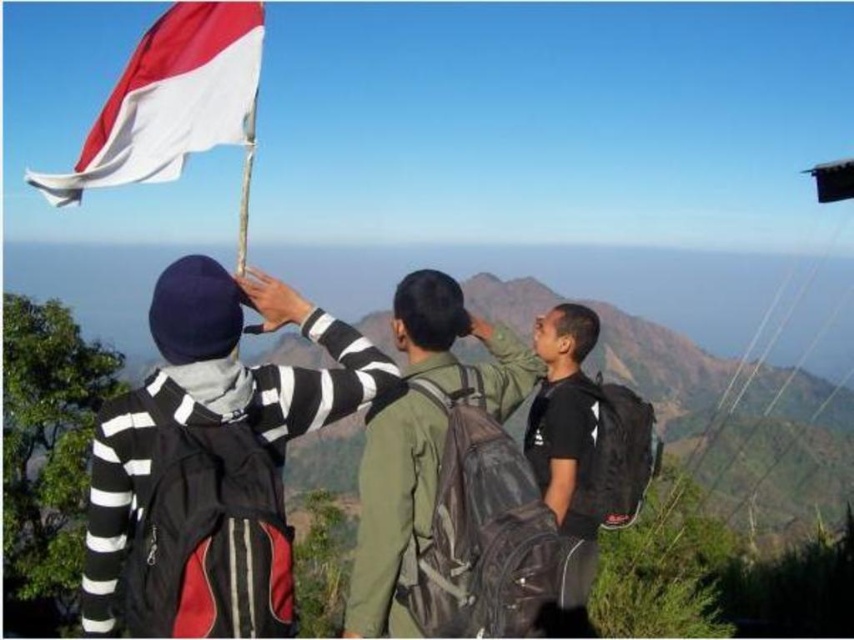
You are a photographer planning to take a group photo of the striped fabric sweater at left and the green matte jacket at center. Based on their positions, which one is lower in the frame?

The striped fabric sweater at left is located below the green matte jacket at center, so it is lower in the frame.

You are standing at the point labeled point (235, 413) and want to move to the point labeled point (214, 86). Given that the distance between these two points is 0.5 meters, can you safely walk from your current position to the other point without any obstacles?

Yes, you can safely walk from point (235, 413) to point (214, 86) since the distance is 0.5 meters and there are no obstacles mentioned in the scene description.